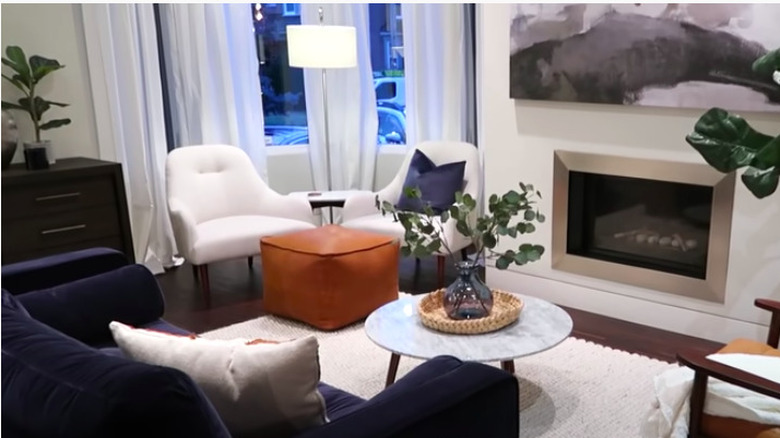
The height and width of the screenshot is (438, 780). In order to click on fireplace in this screenshot , I will do `click(649, 217)`.